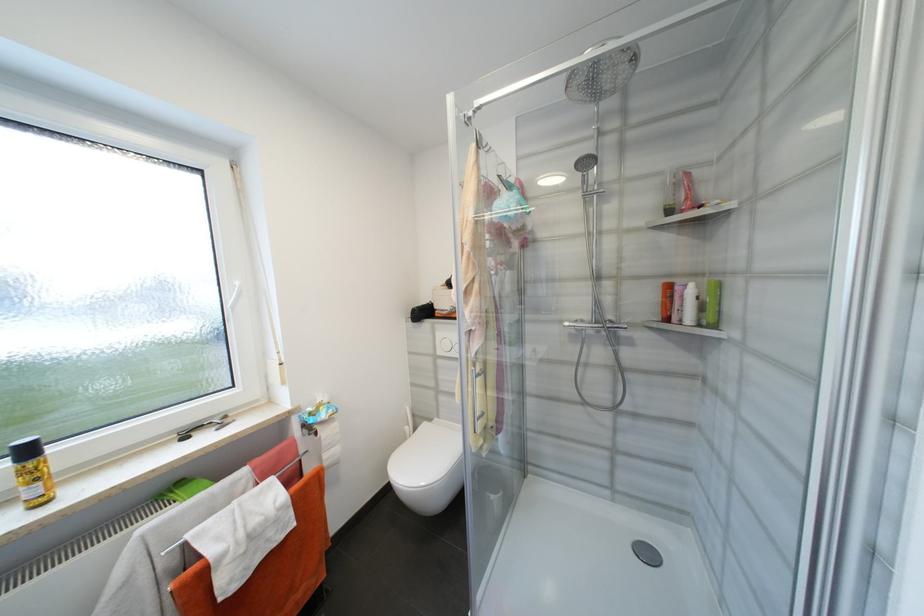
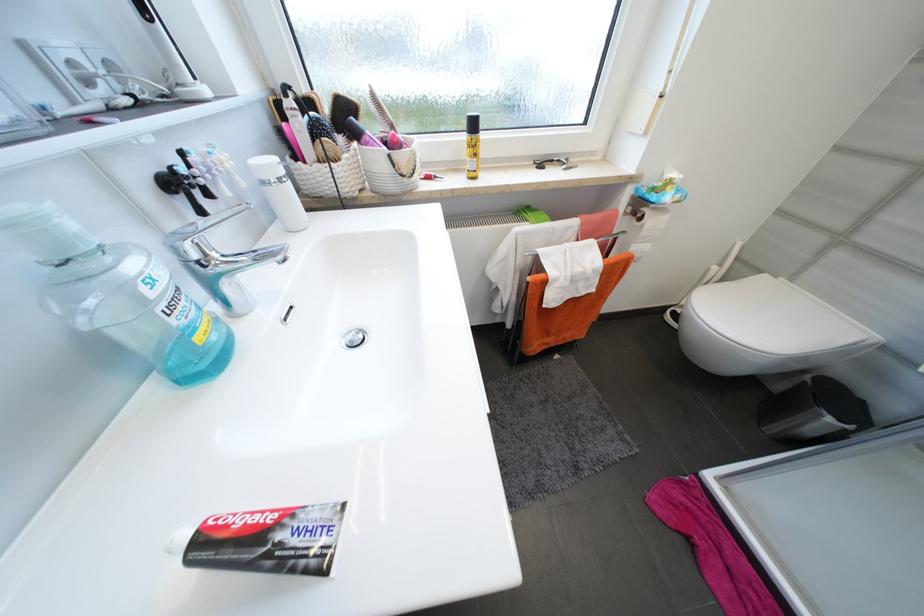
Locate, in the second image, the point that corresponds to [322,435] in the first image.

(647, 219)